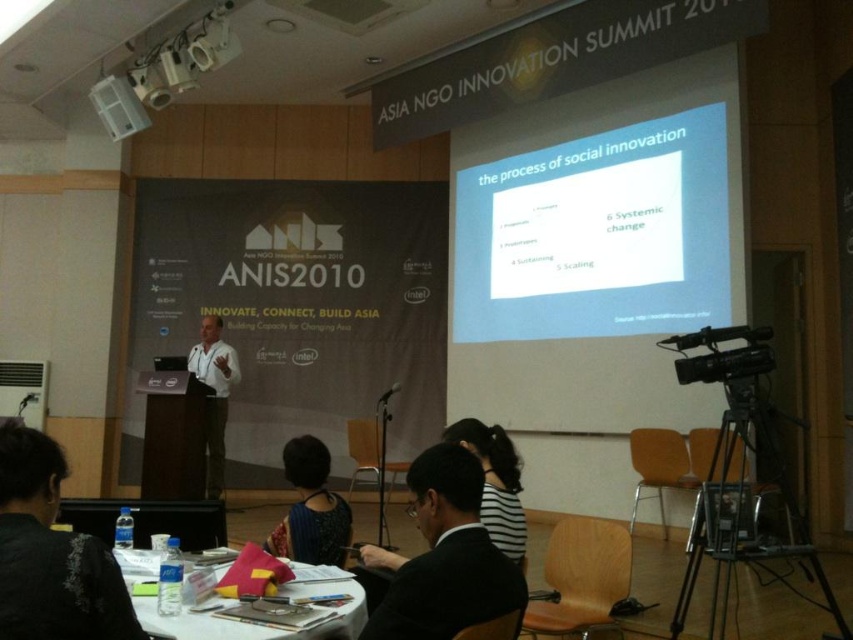
From the picture: You are an attendee at the Asia NGO Innovation Summit 2010. You notice two points on the stage setup. One is at point coordinates point (198, 368) and the other at point (393, 392). From your perspective sitting in the audience, which point is closer to the front of the stage?

Point (393, 392) is closer to the front of the stage because point (198, 368) is behind it.

You are an event photographer at the Asia NGO Innovation Summit 2010. You need to capture a clear photo of the speaker wearing the white shirt at center and holding the black matte microphone at center. However, your camera has a limited depth of field. Which object should you focus on to ensure both are in focus?

You should focus on the white shirt at center because it is larger in size than the black matte microphone at center, so focusing on the larger object will help ensure both are within the depth of field.